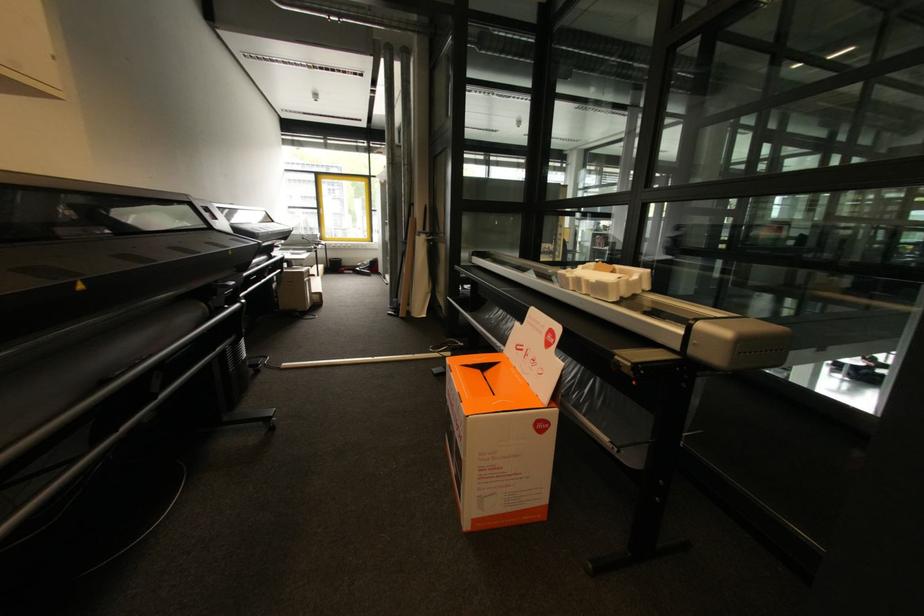
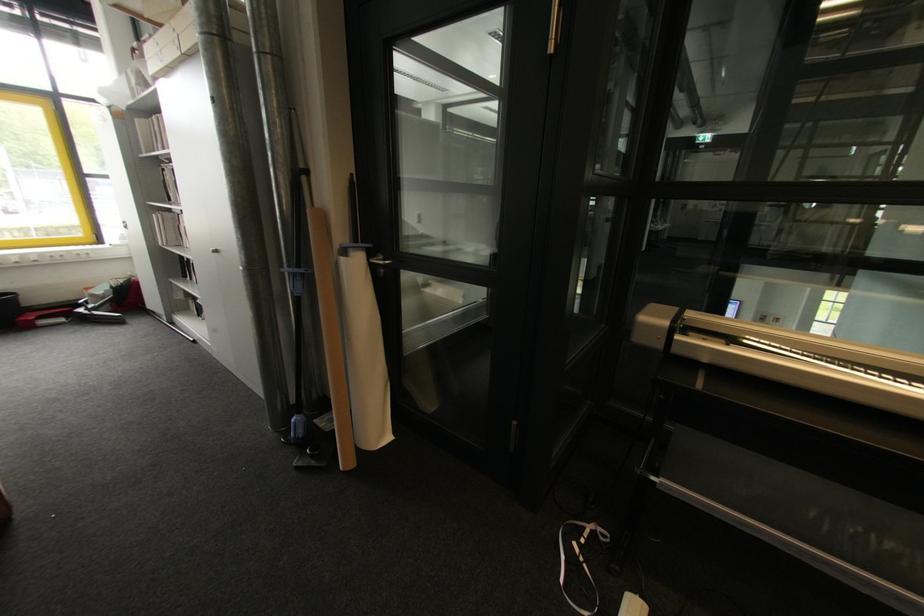
The point at (x=428, y=317) is marked in the first image. Where is the corresponding point in the second image?

(393, 438)